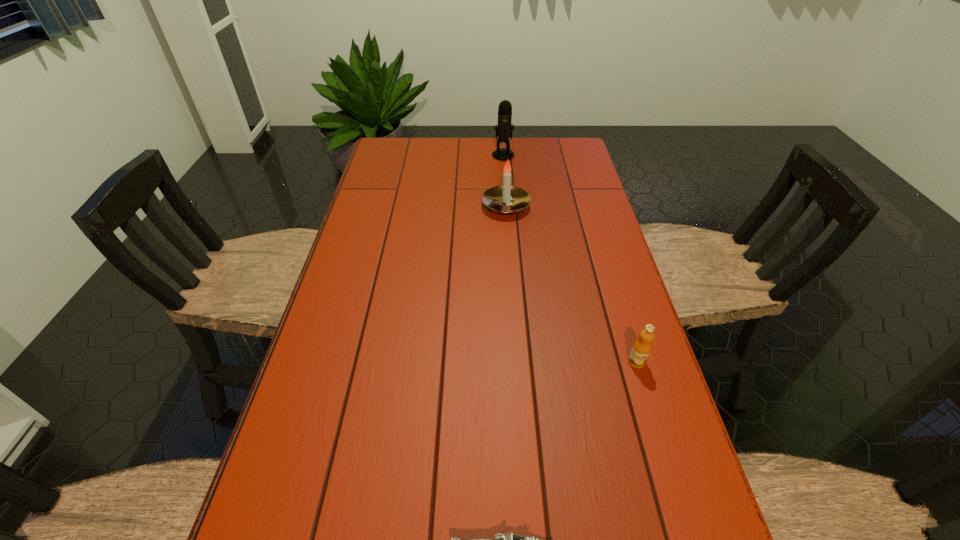
This screenshot has width=960, height=540. I want to click on object that is the third closest to the candle, so click(509, 539).